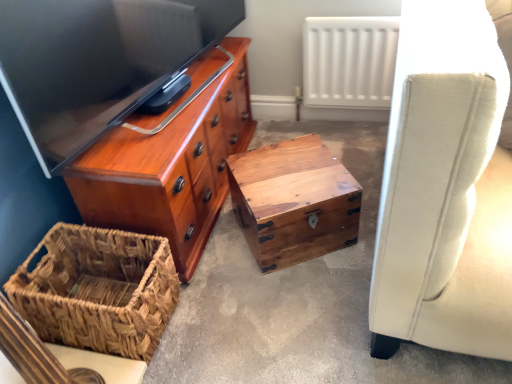
Question: From the image's perspective, relative to natural wood trunk at center, is wooden chest at center above or below?

Choices:
 (A) above
 (B) below

Answer: (B)

Question: Is wooden chest at center in front of or behind natural wood trunk at center in the image?

Choices:
 (A) front
 (B) behind

Answer: (A)

Question: Which object is the closest to the wooden chest at center?

Choices:
 (A) natural wood trunk at center
 (B) shiny wood chest of drawers at upper left
 (C) white matte radiator at upper center
 (D) woven brown picnic basket at lower left

Answer: (A)

Question: Considering the real-world distances, which object is closest to the white matte radiator at upper center?

Choices:
 (A) woven brown picnic basket at lower left
 (B) natural wood trunk at center
 (C) shiny wood chest of drawers at upper left
 (D) wooden chest at center

Answer: (D)